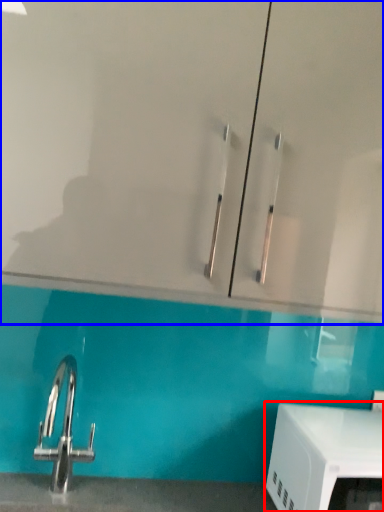
Question: Which object appears closest to the camera in this image, appliance (highlighted by a red box) or glass door (highlighted by a blue box)?

Choices:
 (A) appliance
 (B) glass door

Answer: (B)